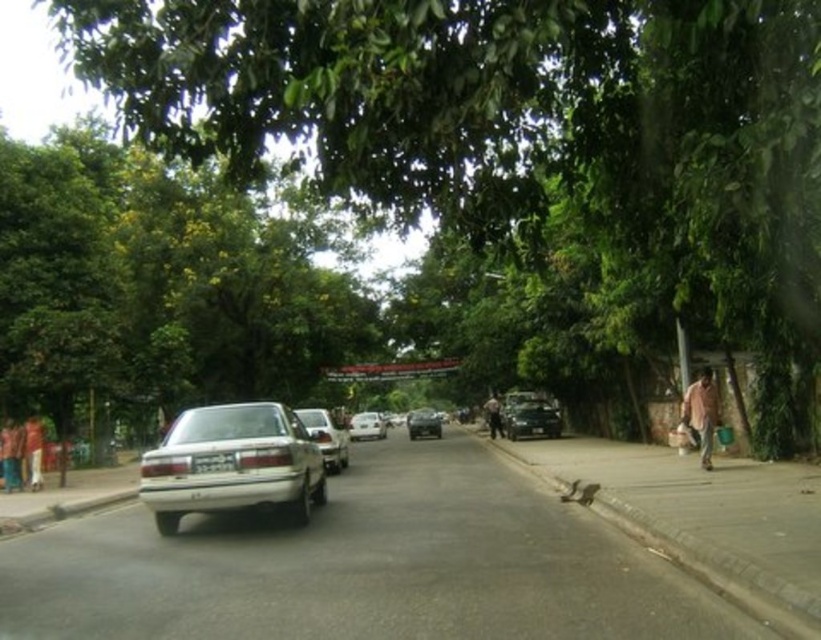
You are a delivery driver needing to pass through the road between the green leafy tree at center and the shiny black car at right. Can your delivery van, which is 2 meters wide, fit through the space?

The green leafy tree at center is wider than the shiny black car at right. However, the description only provides relative width between the two objects and does not specify the exact width of the space between them. Without knowing the actual width of the gap, it is impossible to determine if the 2 meter wide delivery van can fit through.